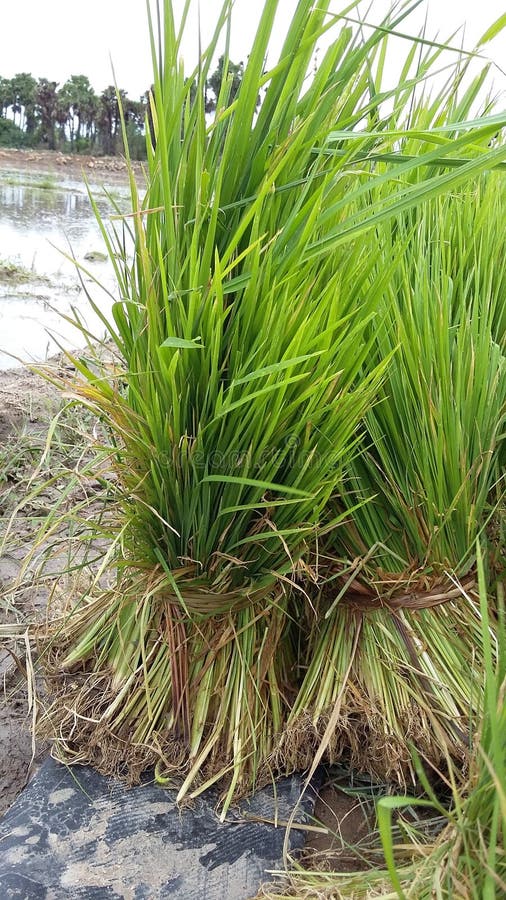
Find the location of a particular element. This screenshot has height=900, width=506. tall plants is located at coordinates click(8, 128).